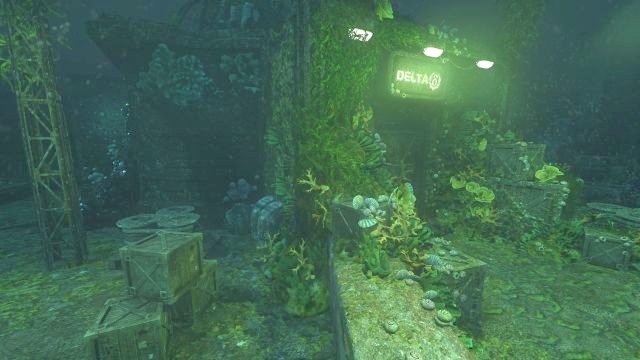
Locate an element on the screen. This screenshot has width=640, height=360. entrance door is located at coordinates (402, 154).